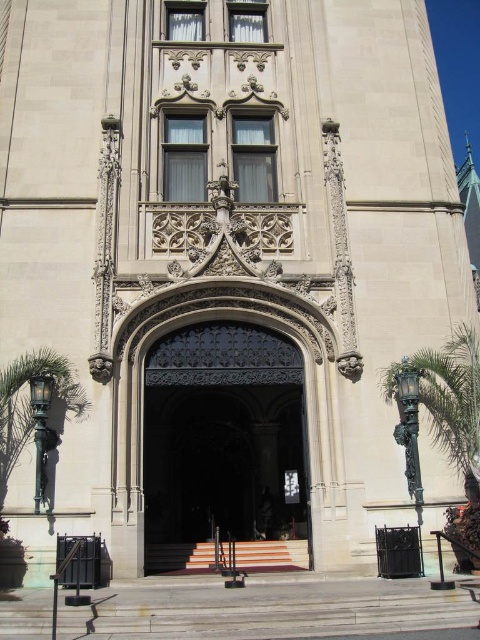
You are standing at the entrance of the grand building and want to go up the orange carpeted stairs at center. There is a green leafy palm tree at right in your way. Can you walk around the palm tree to reach the stairs?

The green leafy palm tree at right is in front of orange carpeted stairs at center, so you can walk around it to reach the stairs.

You are a delivery person trying to enter the grand building. The dark wrought iron gate at center is blocking your path. Can you walk around it using the green leafy palm tree at lower left as a landmark? Explain why or why not based on their sizes.

The dark wrought iron gate at center is larger in size than the green leafy palm tree at lower left. Since the gate is bigger, it might block the path more extensively, but the palm tree could still serve as a visible landmark to navigate around the gate. However, without knowing the exact layout, it is uncertain if there is a clear path around the gate near the palm tree.

You are standing at the entrance of the grand building and see the point marked at coordinates (x=452, y=394). What object is located at that point?

The point at coordinates (x=452, y=394) corresponds to the green leafy palm tree at right.